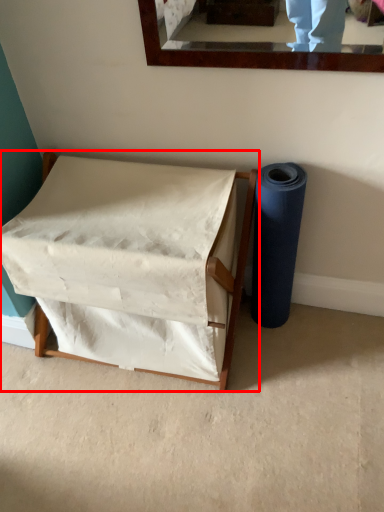
Question: From the image's perspective, where is furniture (annotated by the red box) located relative to toilet paper?

Choices:
 (A) below
 (B) above

Answer: (A)